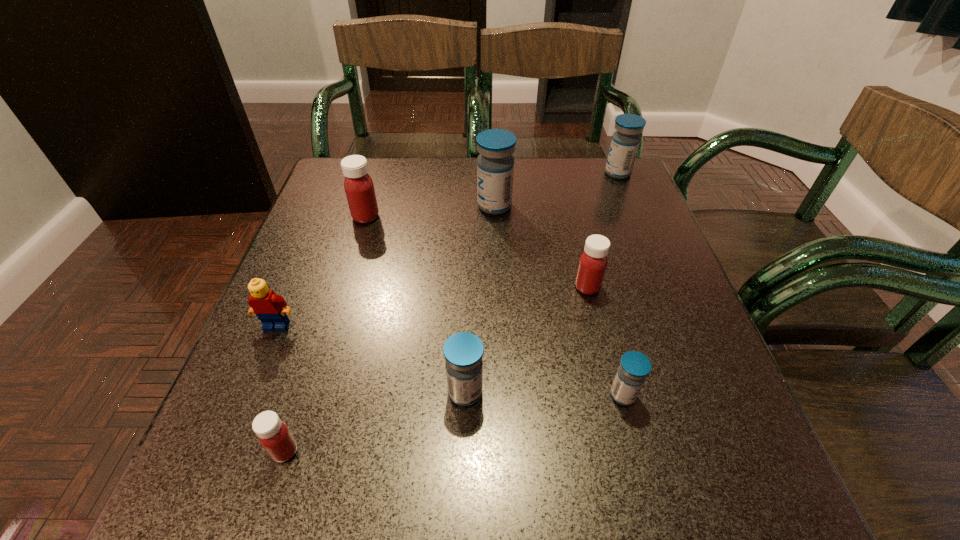
What are the coordinates of `the biggest blue medicine` in the screenshot? It's located at (495, 165).

Where is `the tallest medicine`? The image size is (960, 540). the tallest medicine is located at coordinates (495, 165).

The image size is (960, 540). I want to click on the farthest medicine, so click(625, 141).

This screenshot has height=540, width=960. Identify the location of the rightmost medicine. (625, 141).

Identify the location of the farthest red medicine. The height and width of the screenshot is (540, 960). (359, 188).

Identify the location of the second nearest red medicine. (593, 262).

Locate an element on the screen. the rightmost red medicine is located at coordinates (593, 262).

This screenshot has width=960, height=540. Find the location of `the third biggest blue medicine`. the third biggest blue medicine is located at coordinates (463, 352).

The width and height of the screenshot is (960, 540). Find the location of `Lego`. Lego is located at coordinates (270, 308).

Image resolution: width=960 pixels, height=540 pixels. I want to click on the leftmost object, so click(270, 308).